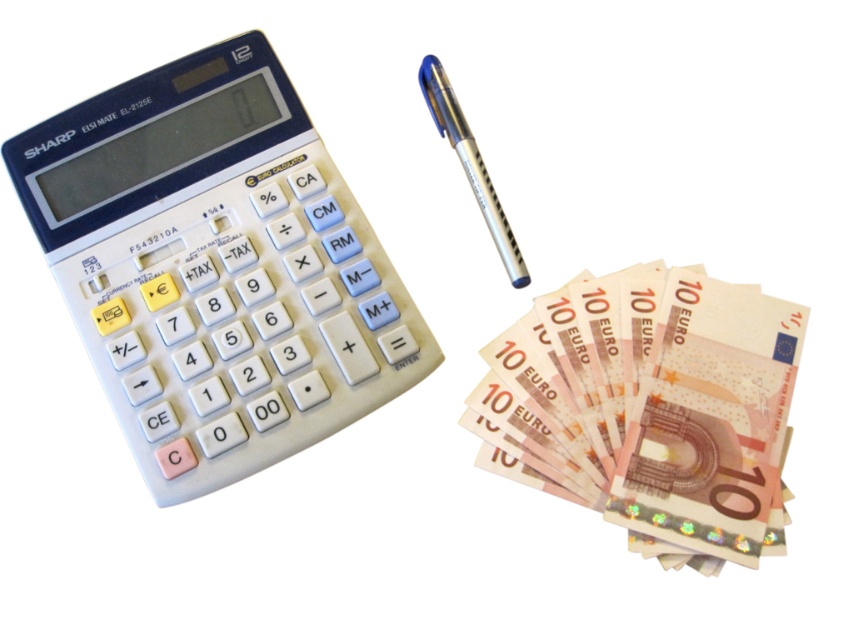
Measure the distance between white plastic calculator at left and camera.

white plastic calculator at left and camera are 38.37 inches apart from each other.

Where is `white plastic calculator at left`? The height and width of the screenshot is (640, 853). white plastic calculator at left is located at coordinates (216, 268).

Is white plastic calculator at left smaller than silver metallic pen at upper center?

No, white plastic calculator at left is not smaller than silver metallic pen at upper center.

Can you confirm if white plastic calculator at left is thinner than silver metallic pen at upper center?

No.

You are a GUI agent. You are given a task and a screenshot of the screen. Output one action in this format:
    pyautogui.click(x=<x>, y=<y>)
    Task: Click on the white plastic calculator at left
    Image resolution: width=853 pixels, height=640 pixels.
    Given the screenshot: What is the action you would take?
    pyautogui.click(x=216, y=268)

Between light pink paper money at right and silver metallic pen at upper center, which one has less height?

silver metallic pen at upper center is shorter.

Is light pink paper money at right shorter than silver metallic pen at upper center?

No, light pink paper money at right is not shorter than silver metallic pen at upper center.

Describe the element at coordinates (693, 412) in the screenshot. I see `light pink paper money at right` at that location.

You are a GUI agent. You are given a task and a screenshot of the screen. Output one action in this format:
    pyautogui.click(x=<x>, y=<y>)
    Task: Click on the light pink paper money at right
    The height and width of the screenshot is (640, 853).
    Given the screenshot: What is the action you would take?
    pyautogui.click(x=693, y=412)